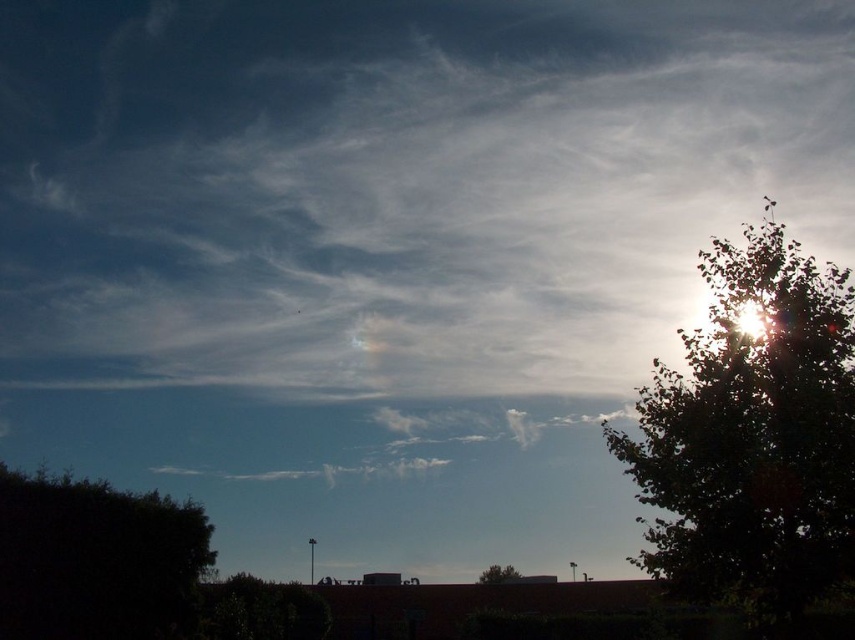
You are an astronomer observing the night sky. You notice two points of light labeled as point (715, 310) and point (207, 547). Which point is closer to your line of sight?

Point (715, 310) is in front of point (207, 547), so it is closer to your line of sight.

You are standing in the field looking at the sky and the green leafy tree at right. If you want to take a photo of the tree against the sunset, where should you position yourself relative to the tree?

You should position yourself to the left of the green leafy tree at right to capture it against the sunset, as the tree is located at the right side of the image where the sun is setting.

You are standing in a field and see two trees, the green leafy tree at lower left and the green leafy tree at lower center. Which tree would appear larger to you?

The green leafy tree at lower left is closer to the viewer, so it would appear larger than the green leafy tree at lower center.